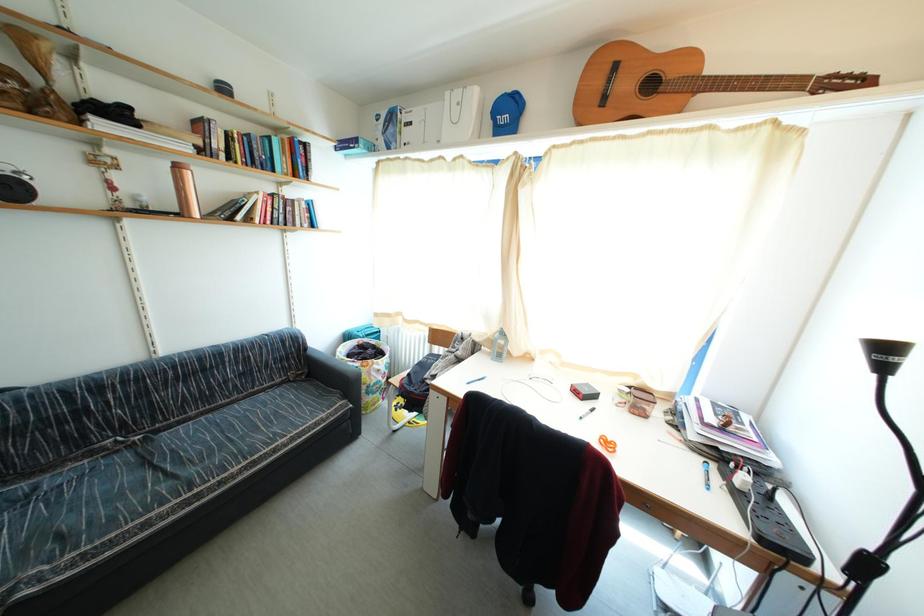
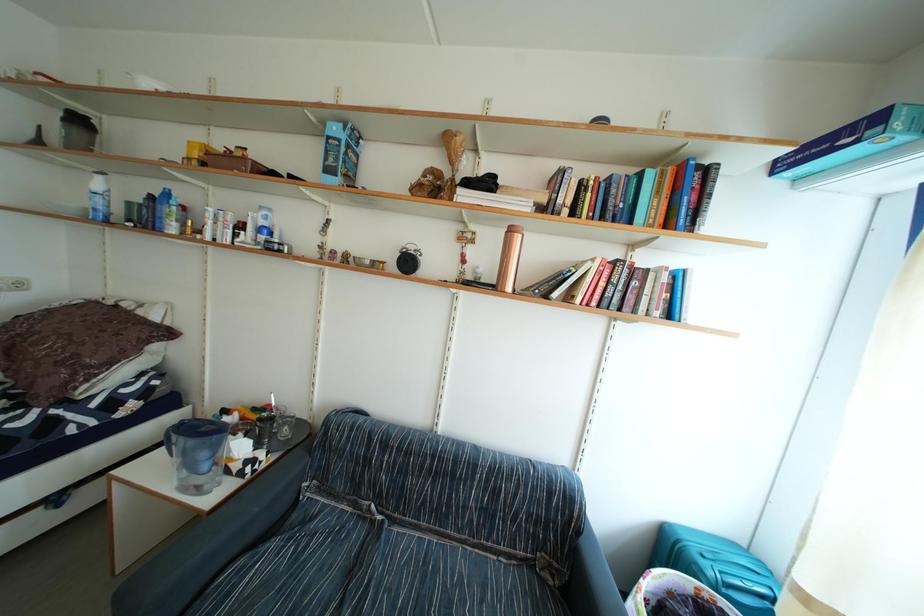
Question: The images are taken continuously from a first-person perspective. In which direction is your viewpoint rotating?

Choices:
 (A) Left
 (B) Right
 (C) Up
 (D) Down

Answer: (A)